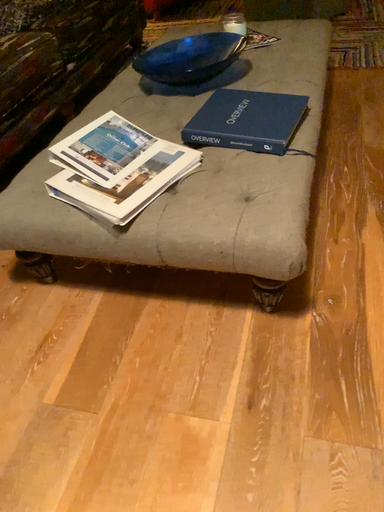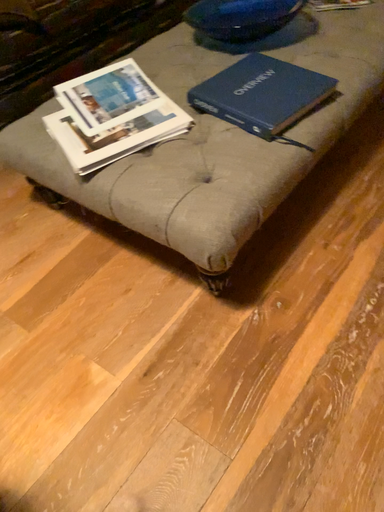
Question: Which way did the camera rotate in the video?

Choices:
 (A) rotated right
 (B) rotated left

Answer: (B)